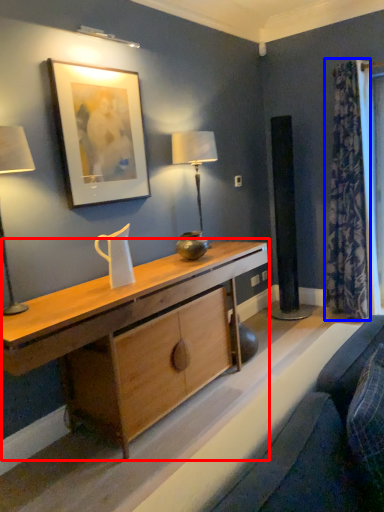
Question: Among these objects, which one is farthest to the camera, desk (highlighted by a red box) or curtain (highlighted by a blue box)?

Choices:
 (A) desk
 (B) curtain

Answer: (B)